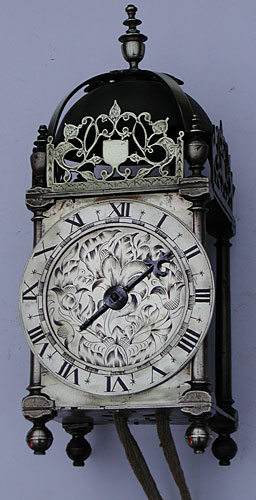
I want to click on clock dial, so click(138, 385), click(203, 312), click(172, 227), click(37, 267), click(51, 361), click(88, 210).